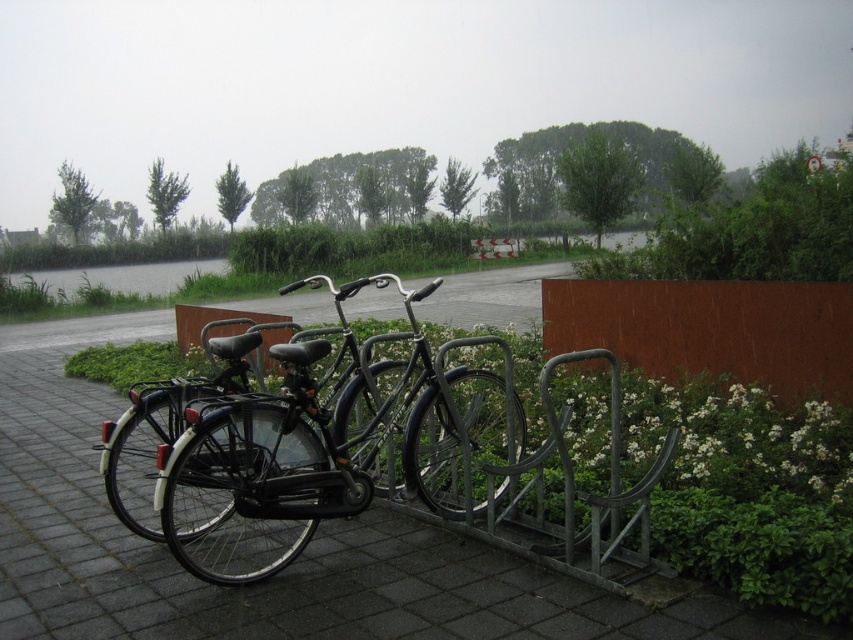
Can you confirm if metallic gray pavement at center is smaller than shiny black bicycle at center?

Correct, metallic gray pavement at center occupies less space than shiny black bicycle at center.

Can you confirm if metallic gray pavement at center is positioned below shiny black bicycle at center?

Yes.

Identify the location of metallic gray pavement at center. (283, 570).

This screenshot has width=853, height=640. Find the location of `metallic gray pavement at center`. metallic gray pavement at center is located at coordinates (283, 570).

Between metallic gray pavement at center and rusty metal fence at center right, which one is positioned lower?

metallic gray pavement at center

Based on the photo, can you confirm if metallic gray pavement at center is shorter than rusty metal fence at center right?

Indeed, metallic gray pavement at center has a lesser height compared to rusty metal fence at center right.

Where is `metallic gray pavement at center`? metallic gray pavement at center is located at coordinates (283, 570).

Who is more distant from viewer, [445,385] or [744,348]?

The point [744,348] is behind.

Who is higher up, shiny black bicycle at center or rusty metal fence at center right?

shiny black bicycle at center is higher up.

Who is more forward, [212,557] or [648,326]?

Point [212,557] is more forward.

You are a GUI agent. You are given a task and a screenshot of the screen. Output one action in this format:
    pyautogui.click(x=<x>, y=<y>)
    Task: Click on the shiny black bicycle at center
    The image size is (853, 640).
    Given the screenshot: What is the action you would take?
    [x=293, y=456]